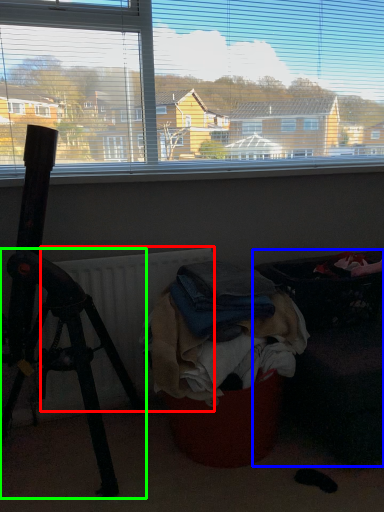
Question: Considering the real-world distances, which object is closest to radiator (highlighted by a red box)? furniture (highlighted by a blue box) or tripod (highlighted by a green box).

Choices:
 (A) furniture
 (B) tripod

Answer: (B)